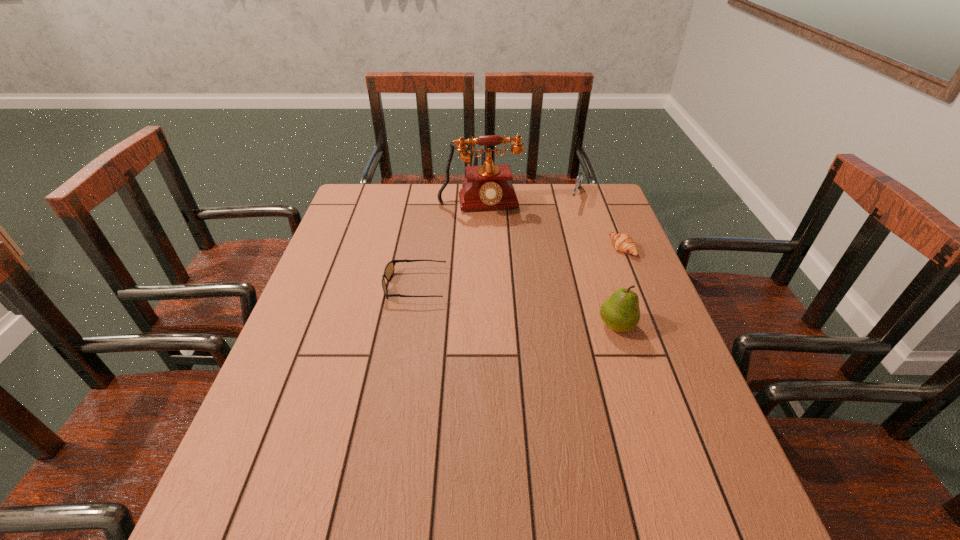
Locate an element on the screen. free space that is in between the rightmost object and the pistol is located at coordinates (599, 223).

Locate an element on the screen. This screenshot has width=960, height=540. the second closest object to the pastry is located at coordinates tap(620, 312).

Locate which object is the fourth closest to the fourth farthest object. Please provide its 2D coordinates. Your answer should be formatted as a tuple, i.e. [(x, y)], where the tuple contains the x and y coordinates of a point satisfying the conditions above.

[(579, 178)]

Where is `vacant area that satisfies the following two spatial constraints: 1. on the front side of the third farthest object; 2. on the left side of the tallest object`? vacant area that satisfies the following two spatial constraints: 1. on the front side of the third farthest object; 2. on the left side of the tallest object is located at coordinates (479, 248).

What are the coordinates of `free location that satisfies the following two spatial constraints: 1. on the front side of the third tallest object; 2. on the right side of the pear` in the screenshot? It's located at (615, 326).

At what (x,y) coordinates should I click in order to perform the action: click on free point that satisfies the following two spatial constraints: 1. on the back side of the second tallest object; 2. on the left side of the rightmost object. Please return your answer as a coordinate pair (x, y). This screenshot has width=960, height=540. Looking at the image, I should click on [592, 248].